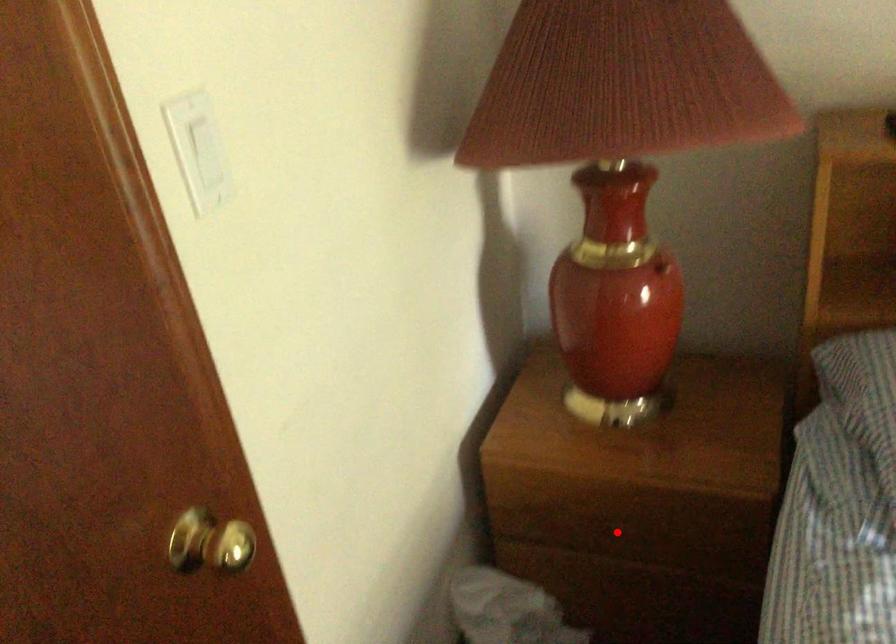
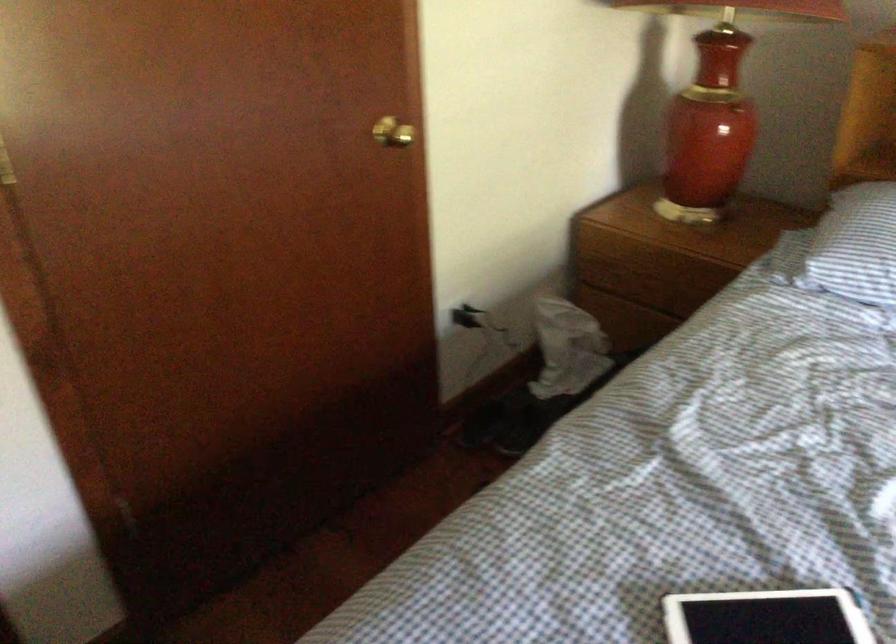
Question: I am providing you with two images of the same scene from different viewpoints. Given a red point in image1, look at the same physical point in image2. Is it:

Choices:
 (A) Closer to the viewpoint
 (B) Farther from the viewpoint

Answer: (B)